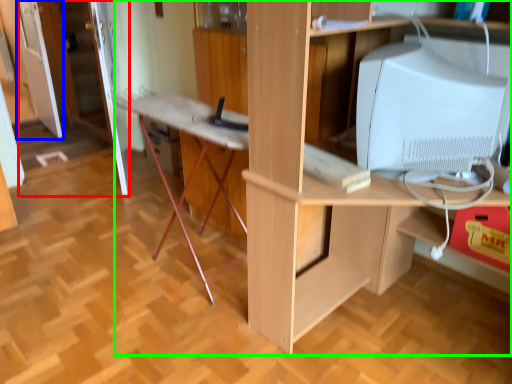
Question: Which is farther away from door (highlighted by a red box)? glass door (highlighted by a blue box) or desk (highlighted by a green box)?

Choices:
 (A) glass door
 (B) desk

Answer: (B)